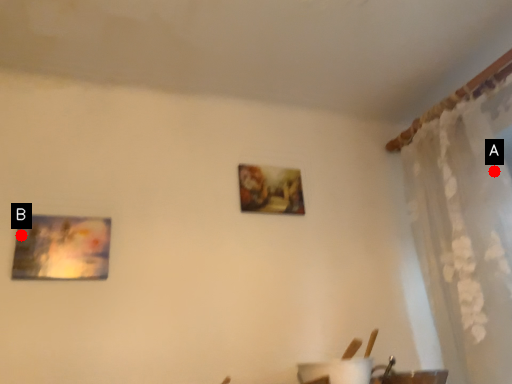
Question: Two points are circled on the image, labeled by A and B beside each circle. Among these points, which one is farthest from the camera?

Choices:
 (A) A is further
 (B) B is further

Answer: (A)